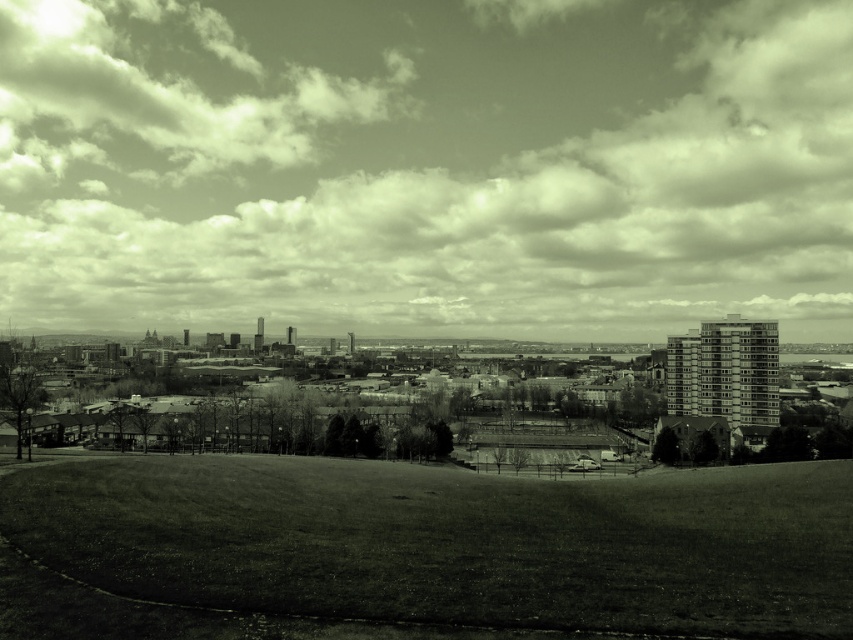
You are standing in the urban landscape shown in the image. If you look directly ahead, where would you see the cloudy sky at upper center?

The cloudy sky at upper center is located at the 2D coordinates point (x=425, y=166) in the image, so if you look directly ahead, you would see it at that position.

You are standing at the grassy hill in the foreground of the urban landscape. You see two points marked in the image, point 1 at coordinates point (213, 74) and point 2 at coordinates point (173, 593). Which point is closer to you?

Point (213, 74) is closer to you because it is further to the viewer than point (173, 593).

You are standing on the green grass at center and looking towards the cloudy sky at upper center. Which object is higher from the ground?

The cloudy sky at upper center is much taller than the green grass at center, so the cloudy sky at upper center is higher from the ground.